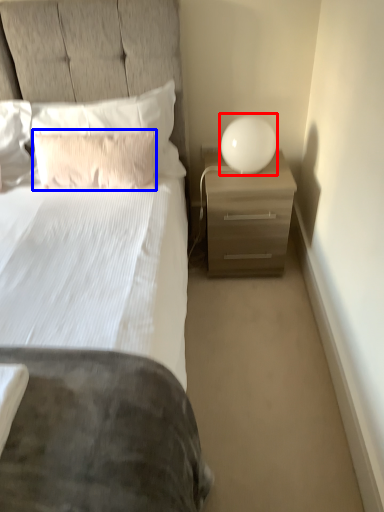
Question: Which object appears closest to the camera in this image, table lamp (highlighted by a red box) or pillow (highlighted by a blue box)?

Choices:
 (A) table lamp
 (B) pillow

Answer: (B)